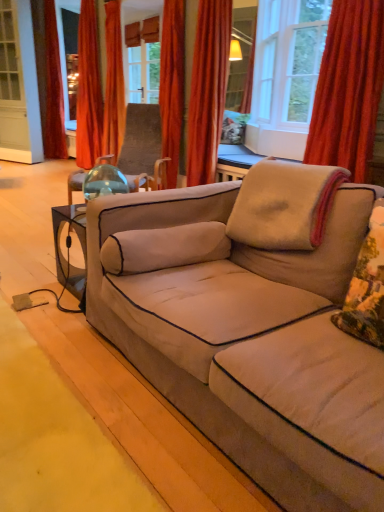
Question: From the image's perspective, is orange velvet curtain at upper left, the 4th curtain viewed from the right, positioned above or below wooden paneling at upper center?

Choices:
 (A) below
 (B) above

Answer: (A)

Question: Is orange velvet curtain at upper left, which is the 2th curtain from left to right, to the left or to the right of wooden paneling at upper center in the image?

Choices:
 (A) right
 (B) left

Answer: (B)

Question: Which is farther from the velvet orange curtain at upper center, arranged as the 2th curtain when viewed from the front?

Choices:
 (A) beige soft pillow at upper right, arranged as the first pillow when viewed from the back
 (B) orange velvet curtain at upper left, the 4th curtain viewed from the right
 (C) velvet red curtain at left, placed as the first curtain when sorted from back to front
 (D) beige fabric couch at center
 (E) orange velvet curtain at upper center, the third curtain when ordered from back to front

Answer: (C)

Question: Which object is positioned farthest from the wooden paneling at upper center?

Choices:
 (A) beige fabric couch at center
 (B) orange velvet curtain at upper center, placed as the third curtain when sorted from right to left
 (C) velvet red curtain at left, which ranks as the 1th curtain in left-to-right order
 (D) velvet orange curtain at upper right, marked as the fifth curtain in a left-to-right arrangement
 (E) velvet orange curtain at upper center, the 4th curtain when ordered from back to front

Answer: (A)